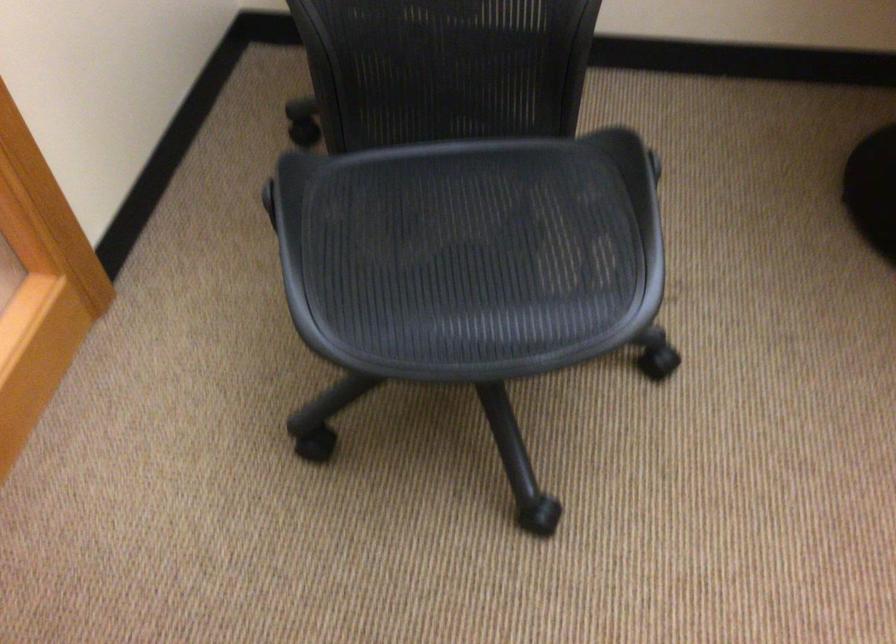
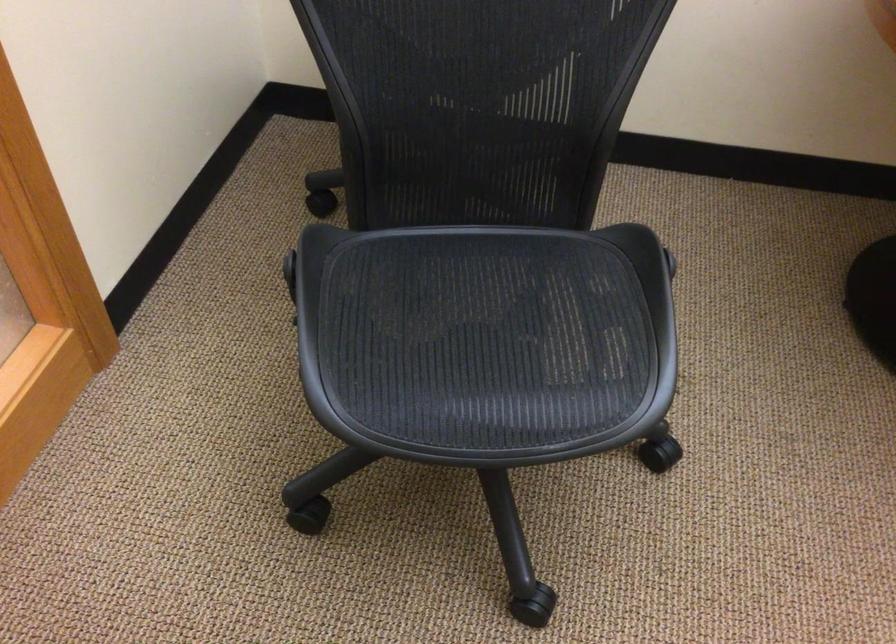
Question: What movement of the cameraman would produce the second image?

Choices:
 (A) Left
 (B) Right
 (C) Forward
 (D) Backward

Answer: (A)